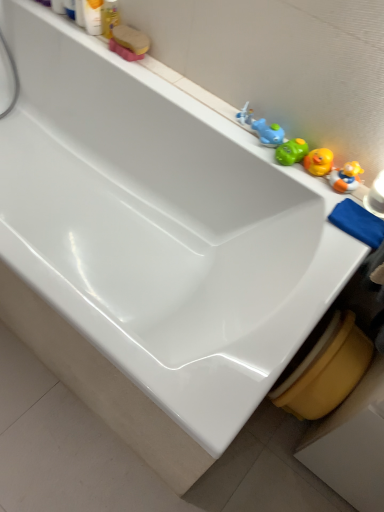
Find the location of `free location to the left of blue cloth at right`. free location to the left of blue cloth at right is located at coordinates (315, 203).